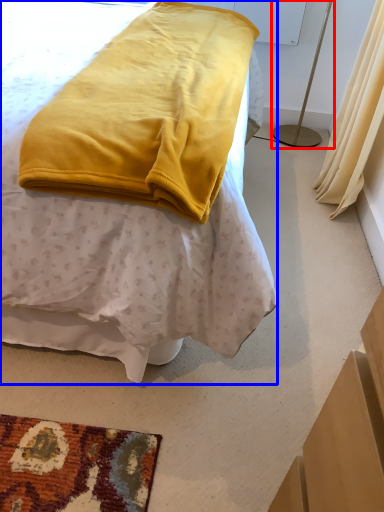
Question: Among these objects, which one is farthest to the camera, bedside lamp (highlighted by a red box) or bed (highlighted by a blue box)?

Choices:
 (A) bedside lamp
 (B) bed

Answer: (A)